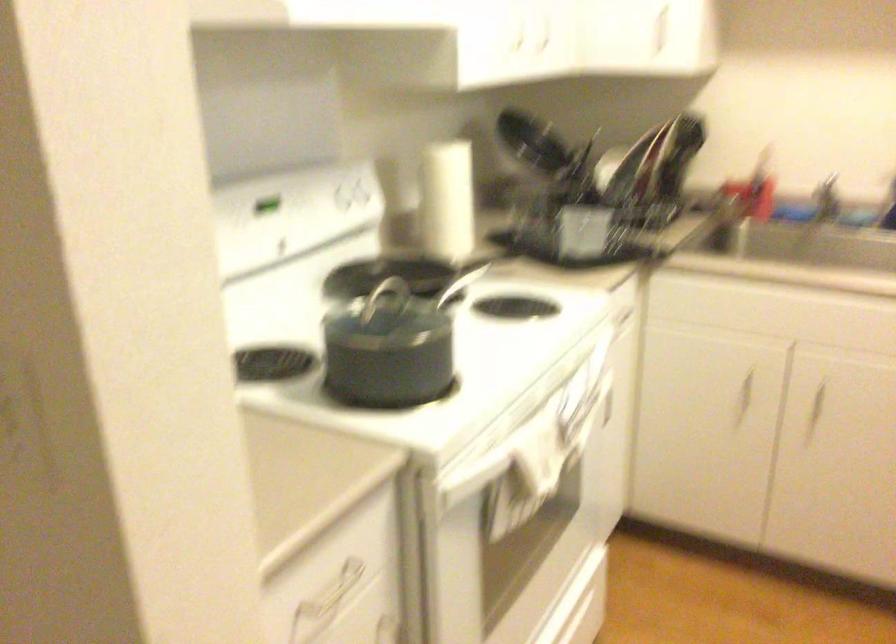
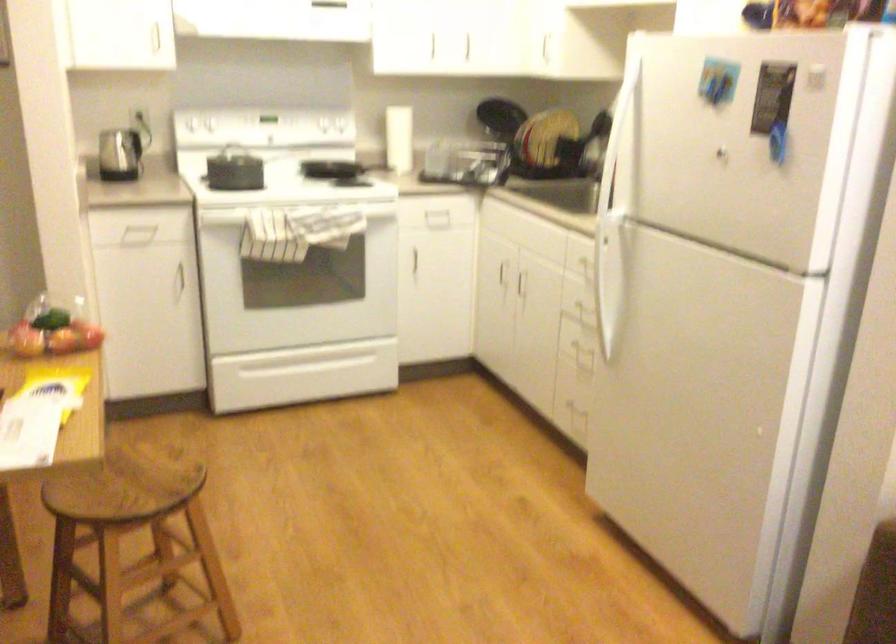
In the second image, find the point that corresponds to the point at 458,205 in the first image.

(399, 138)